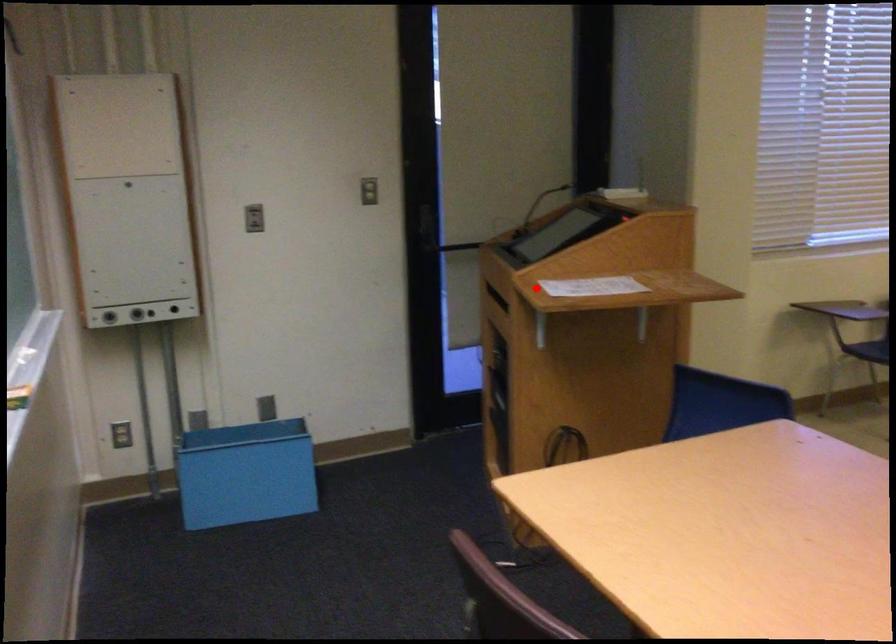
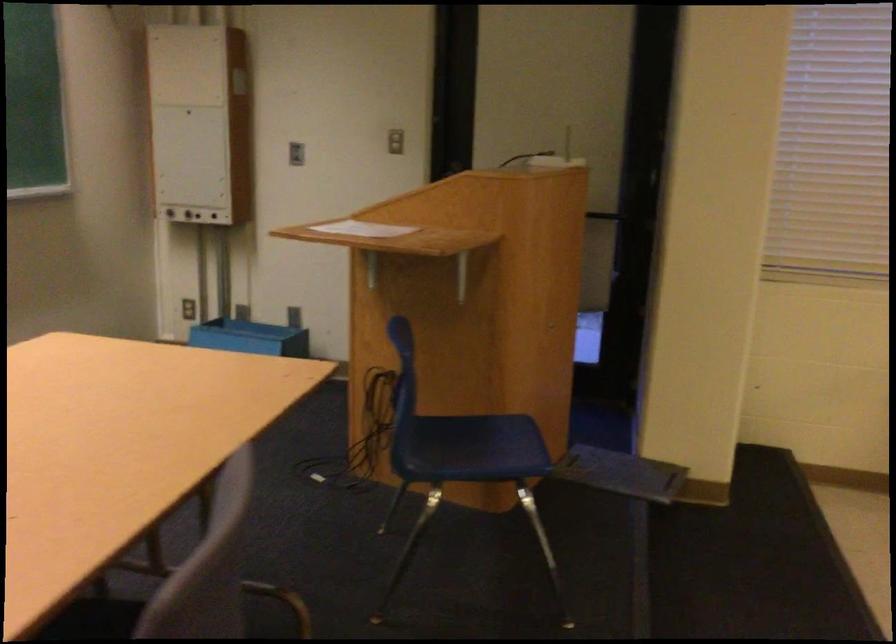
Find the pixel in the second image that matches the highlighted location in the first image.

(362, 229)